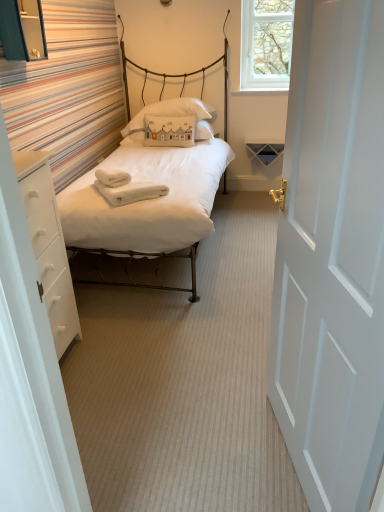
Locate an element on the screen. The height and width of the screenshot is (512, 384). free spot behind white painted wood door at right is located at coordinates (231, 391).